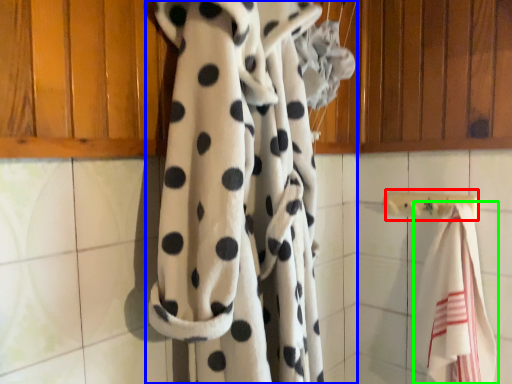
Question: Estimate the real-world distances between objects in this image. Which object is closer to towel bar (highlighted by a red box), curtain (highlighted by a blue box) or towel (highlighted by a green box)?

Choices:
 (A) curtain
 (B) towel

Answer: (B)